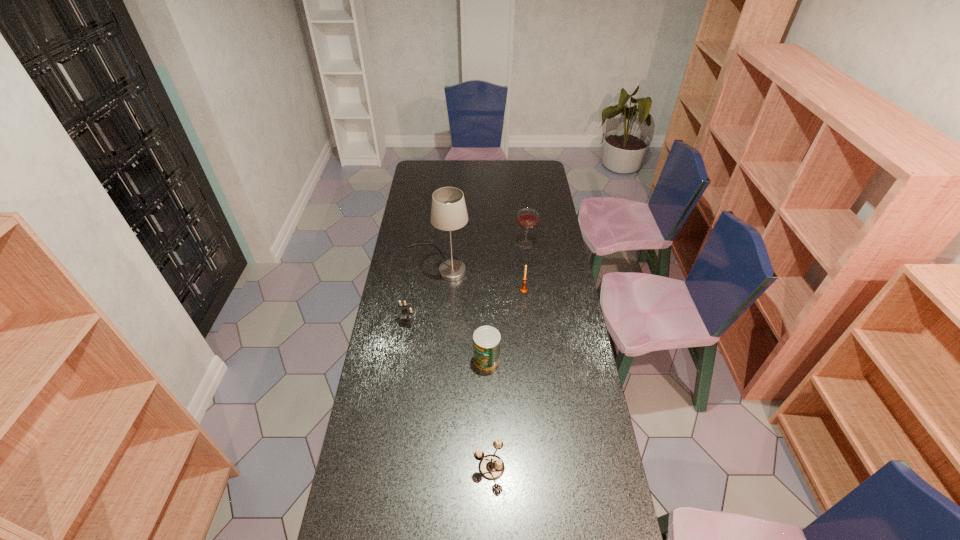
What are the coordinates of `vacant space in between the wineglass and the nearest object` in the screenshot? It's located at (508, 356).

Identify the location of vacant space that's between the can and the table lamp. This screenshot has height=540, width=960. click(462, 312).

Locate which object is the closest to the rightmost candle holder. Please provide its 2D coordinates. Your answer should be formatted as a tuple, i.e. [(x, y)], where the tuple contains the x and y coordinates of a point satisfying the conditions above.

[(448, 211)]

This screenshot has height=540, width=960. What are the coordinates of `object that can be found as the third closest to the tallest object` in the screenshot? It's located at (523, 289).

Find the location of a particular element. candle holder that is the third nearest to the table lamp is located at coordinates (491, 467).

Select which candle holder appears as the second closest to the second nearest candle holder. Please provide its 2D coordinates. Your answer should be formatted as a tuple, i.e. [(x, y)], where the tuple contains the x and y coordinates of a point satisfying the conditions above.

[(491, 467)]

Find the location of a particular element. This screenshot has height=540, width=960. vacant space that satisfies the following two spatial constraints: 1. on the back side of the third farthest object; 2. on the left side of the leftmost candle holder is located at coordinates (413, 290).

Identify the location of blank area in the image that satisfies the following two spatial constraints: 1. on the back side of the can; 2. on the left side of the third farthest object. This screenshot has width=960, height=540. (486, 290).